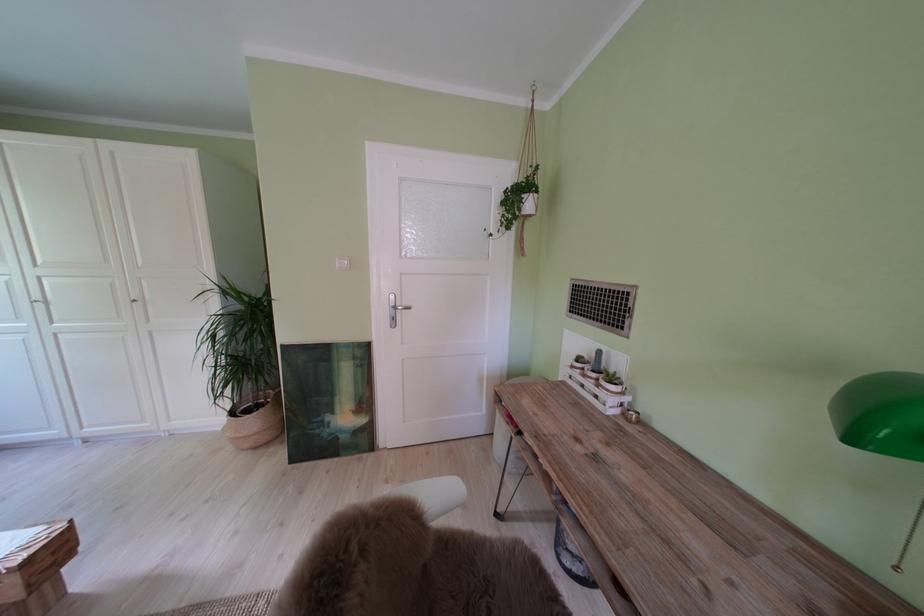
The location [326,399] corresponds to which object?

It corresponds to the framed painting in the image.